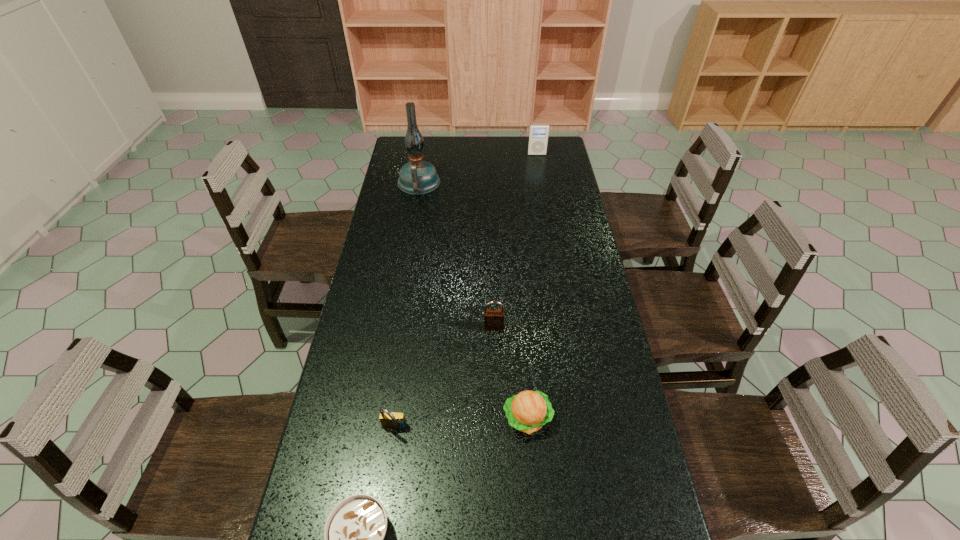
Locate an element on the screen. free space at the left edge of the desktop is located at coordinates (326, 411).

At what (x,y) coordinates should I click in order to perform the action: click on vacant area at the right edge. Please return your answer as a coordinate pair (x, y). Image resolution: width=960 pixels, height=540 pixels. Looking at the image, I should click on (633, 430).

You are a GUI agent. You are given a task and a screenshot of the screen. Output one action in this format:
    pyautogui.click(x=<x>, y=<y>)
    Task: Click on the vacant area at the far left corner
    Image resolution: width=960 pixels, height=540 pixels.
    Given the screenshot: What is the action you would take?
    pyautogui.click(x=425, y=136)

I want to click on free point at the far right corner, so click(x=565, y=154).

Identify the location of free space that is in between the left padlock and the hamburger. This screenshot has width=960, height=540. (461, 423).

Identify the location of empty space between the left padlock and the hamburger. (461, 423).

This screenshot has height=540, width=960. Find the location of `empty space that is in between the right padlock and the farthest object`. empty space that is in between the right padlock and the farthest object is located at coordinates (516, 241).

This screenshot has width=960, height=540. Find the location of `empty location between the hamburger and the second farthest object`. empty location between the hamburger and the second farthest object is located at coordinates (473, 301).

I want to click on vacant point located between the rightmost object and the tallest object, so click(x=478, y=168).

Locate an element on the screen. This screenshot has height=540, width=960. vacant area between the farthest object and the oil lamp is located at coordinates (478, 168).